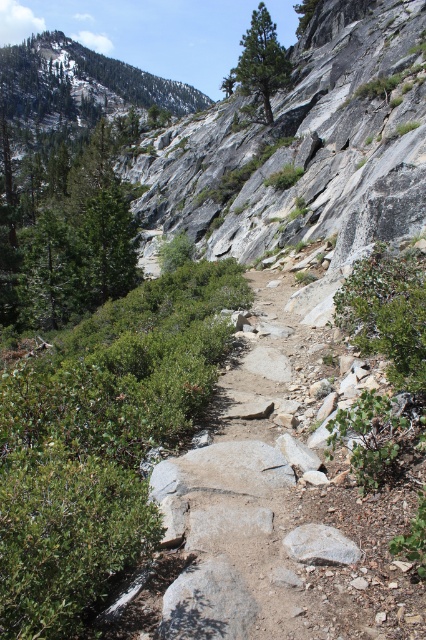
Question: Estimate the real-world distances between objects in this image. Which object is closer to the green textured pine tree at upper center?

Choices:
 (A) green leafy tree at left
 (B) green leafy shrub at upper right
 (C) gray/rough rock at center

Answer: (A)

Question: Can you confirm if green textured pine tree at upper center is positioned above gray/rough rock at center?

Choices:
 (A) no
 (B) yes

Answer: (B)

Question: Estimate the real-world distances between objects in this image. Which object is farther from the gray/rough rock at center?

Choices:
 (A) green textured pine tree at upper center
 (B) green leafy shrub at upper right
 (C) green leafy tree at left

Answer: (A)

Question: Does green textured pine tree at upper center appear on the left side of gray/rough rock at center?

Choices:
 (A) no
 (B) yes

Answer: (A)

Question: Which point is farther to the camera?

Choices:
 (A) (0, 292)
 (B) (245, 40)
 (C) (348, 563)
 (D) (417, 368)

Answer: (B)

Question: Does green leafy tree at left have a greater width compared to green leafy shrub at upper right?

Choices:
 (A) yes
 (B) no

Answer: (A)